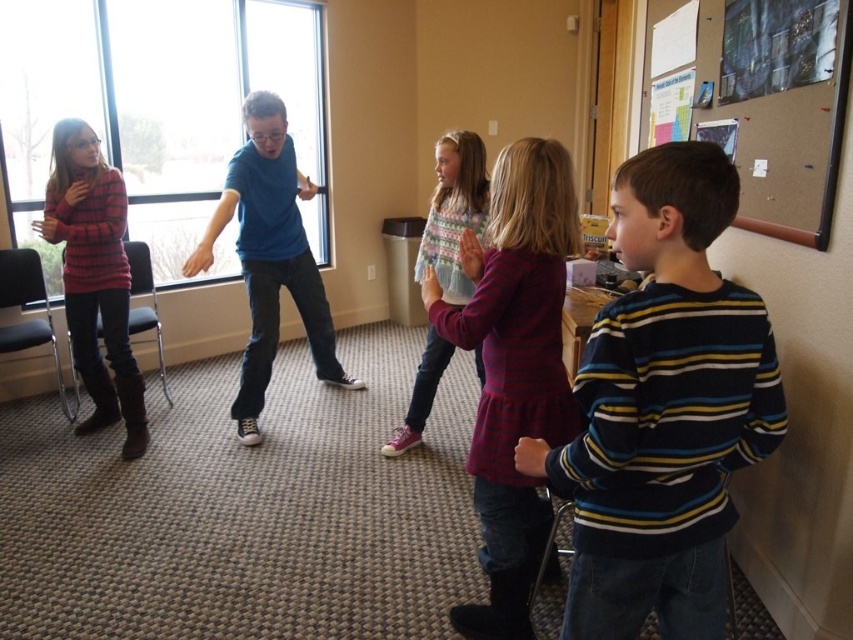
Which of these two, transparent glass window at left or blue cotton shirt at center, stands taller?

Standing taller between the two is transparent glass window at left.

Is point (306, 33) positioned in front of point (245, 438)?

No.

In order to click on transparent glass window at left in this screenshot , I will do `click(154, 106)`.

Does striped cotton dress at center appear on the left side of blue cotton shirt at center?

Incorrect, striped cotton dress at center is not on the left side of blue cotton shirt at center.

Is striped cotton dress at center behind blue cotton shirt at center?

No, it is in front of blue cotton shirt at center.

Where is `striped cotton dress at center`? The width and height of the screenshot is (853, 640). striped cotton dress at center is located at coordinates (514, 365).

Between point (78, 96) and point (511, 177), which one is positioned behind?

The point (78, 96) is behind.

Who is shorter, transparent glass window at left or striped cotton dress at center?

striped cotton dress at center

Is point (224, 161) more distant than point (527, 397)?

Yes.

The width and height of the screenshot is (853, 640). Identify the location of transparent glass window at left. (154, 106).